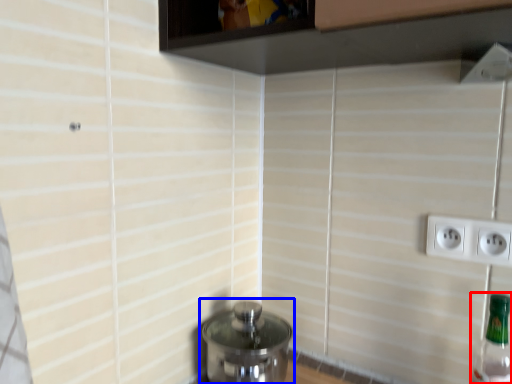
Question: Which point is closer to the camera, bottle (highlighted by a red box) or water heater (highlighted by a blue box)?

Choices:
 (A) bottle
 (B) water heater

Answer: (A)